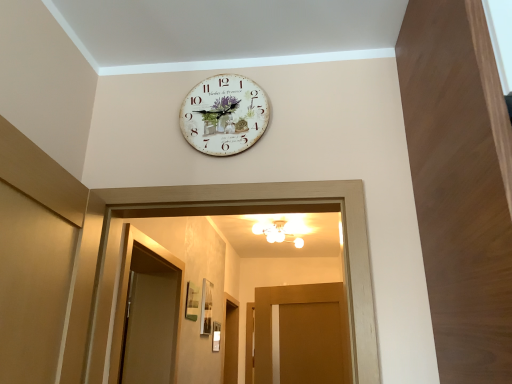
Question: Is there a large distance between matte wood door at center and white painted wood clock at upper center?

Choices:
 (A) yes
 (B) no

Answer: (A)

Question: Considering the relative sizes of matte wood door at center and white painted wood clock at upper center in the image provided, is matte wood door at center shorter than white painted wood clock at upper center?

Choices:
 (A) yes
 (B) no

Answer: (B)

Question: Is matte wood door at center in front of white painted wood clock at upper center?

Choices:
 (A) yes
 (B) no

Answer: (B)

Question: Is matte wood door at center aimed at white painted wood clock at upper center?

Choices:
 (A) yes
 (B) no

Answer: (A)

Question: Is matte wood door at center facing away from white painted wood clock at upper center?

Choices:
 (A) no
 (B) yes

Answer: (A)

Question: Does matte wood door at center have a greater height compared to white painted wood clock at upper center?

Choices:
 (A) no
 (B) yes

Answer: (B)

Question: From the image's perspective, is white painted wood clock at upper center located beneath matte wood door at center?

Choices:
 (A) yes
 (B) no

Answer: (B)

Question: Is white painted wood clock at upper center not within matte wood door at center?

Choices:
 (A) yes
 (B) no

Answer: (A)

Question: Is there a large distance between white painted wood clock at upper center and matte wood door at center?

Choices:
 (A) yes
 (B) no

Answer: (A)

Question: Can you confirm if white painted wood clock at upper center is bigger than matte wood door at center?

Choices:
 (A) no
 (B) yes

Answer: (A)

Question: Can you confirm if white painted wood clock at upper center is positioned to the right of matte wood door at center?

Choices:
 (A) yes
 (B) no

Answer: (B)

Question: Is white painted wood clock at upper center oriented towards matte wood door at center?

Choices:
 (A) yes
 (B) no

Answer: (B)

Question: Considering the relative sizes of white painted wood clock at upper center and white glossy chandelier at upper center in the image provided, is white painted wood clock at upper center taller than white glossy chandelier at upper center?

Choices:
 (A) yes
 (B) no

Answer: (A)